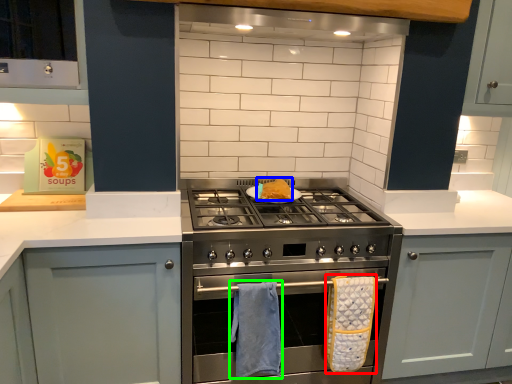
Question: Which object is the farthest from bath towel (highlighted by a red box)? Choose among these: food (highlighted by a blue box) or bath towel (highlighted by a green box).

Choices:
 (A) food
 (B) bath towel

Answer: (A)